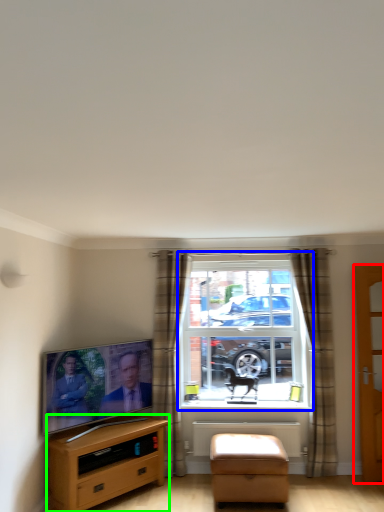
Question: Considering the real-world distances, which object is farthest from door (highlighted by a red box)? window (highlighted by a blue box) or cabinetry (highlighted by a green box)?

Choices:
 (A) window
 (B) cabinetry

Answer: (B)